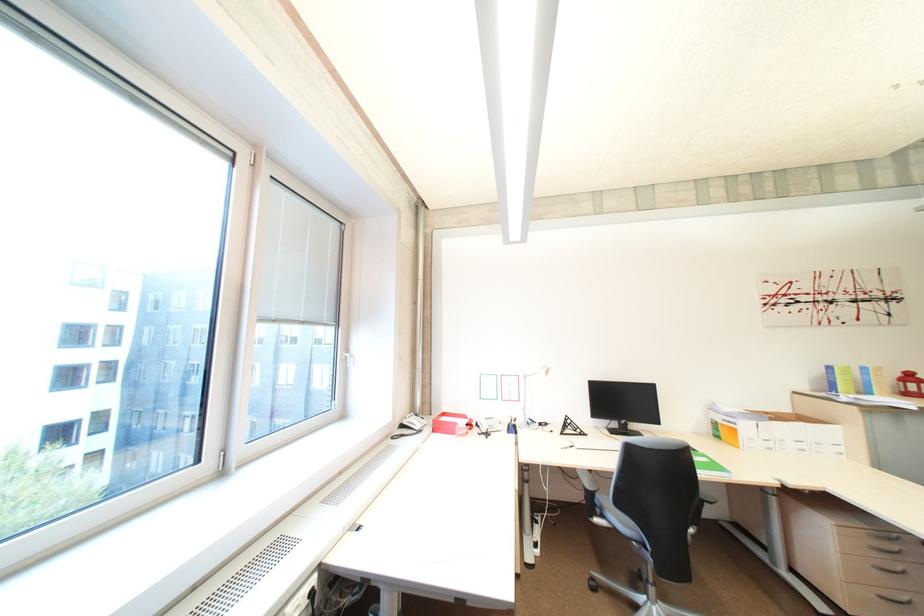
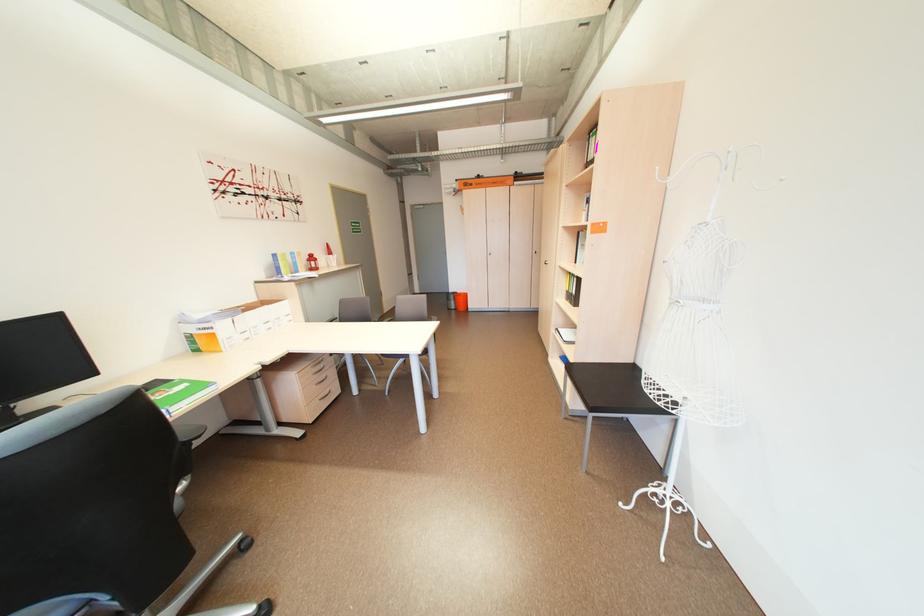
In the scene shown: The first image is from the beginning of the video and the second image is from the end. How did the camera likely rotate when shooting the video?

The camera's rotation is toward right-down.